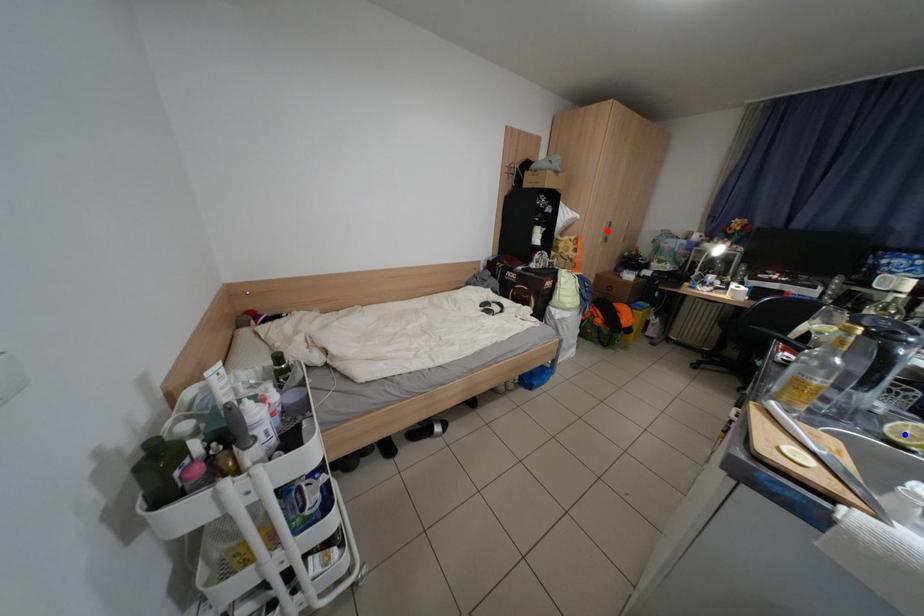
Question: Which of the two points in the image is closer to the camera?

Choices:
 (A) Blue point is closer.
 (B) Red point is closer.

Answer: (A)